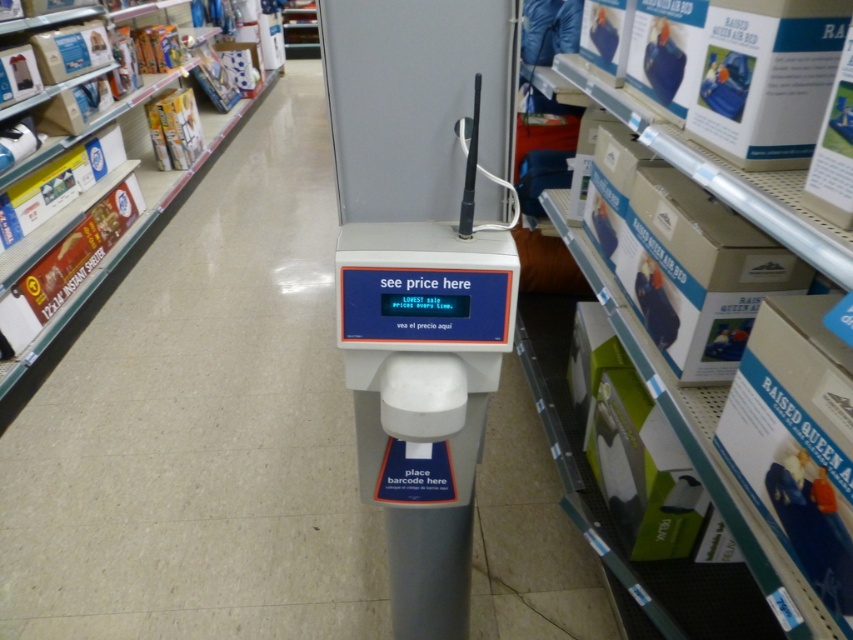
Does white plastic scale at center have a greater width compared to white cardboard boxes at left?

No, white plastic scale at center is not wider than white cardboard boxes at left.

Who is taller, white plastic scale at center or white cardboard boxes at left?

Standing taller between the two is white cardboard boxes at left.

Which is in front, point (409, 632) or point (144, 221)?

Point (409, 632)

I want to click on white plastic scale at center, so click(x=425, y=388).